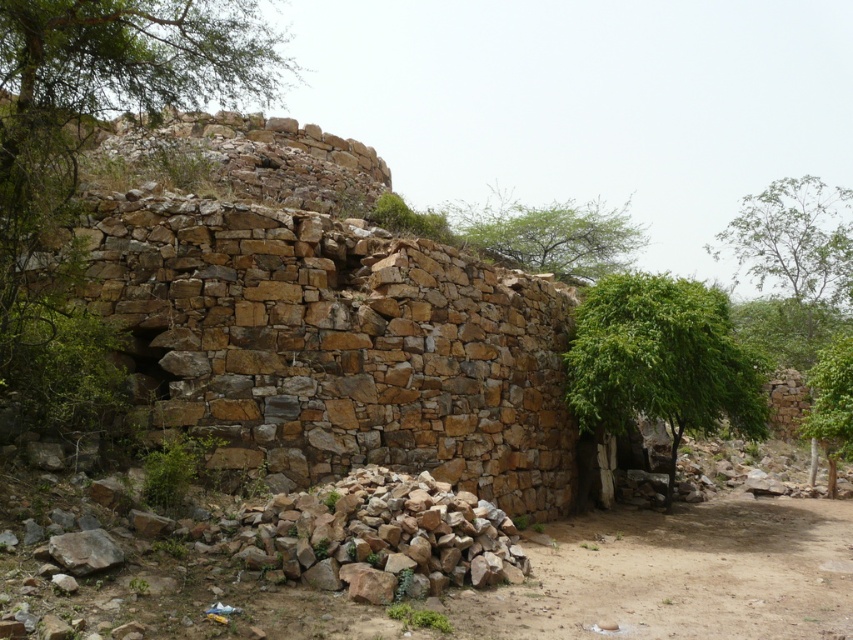
Consider the image. You are standing at the base of the ancient stone structure and want to take a photo of the green leafy tree at upper center. If your camera has a maximum focus range of 35 meters, will you be able to capture the tree clearly?

The green leafy tree at upper center is 36.18 meters away from the camera, which exceeds the camera maximum focus range of 35 meters. Therefore, you won